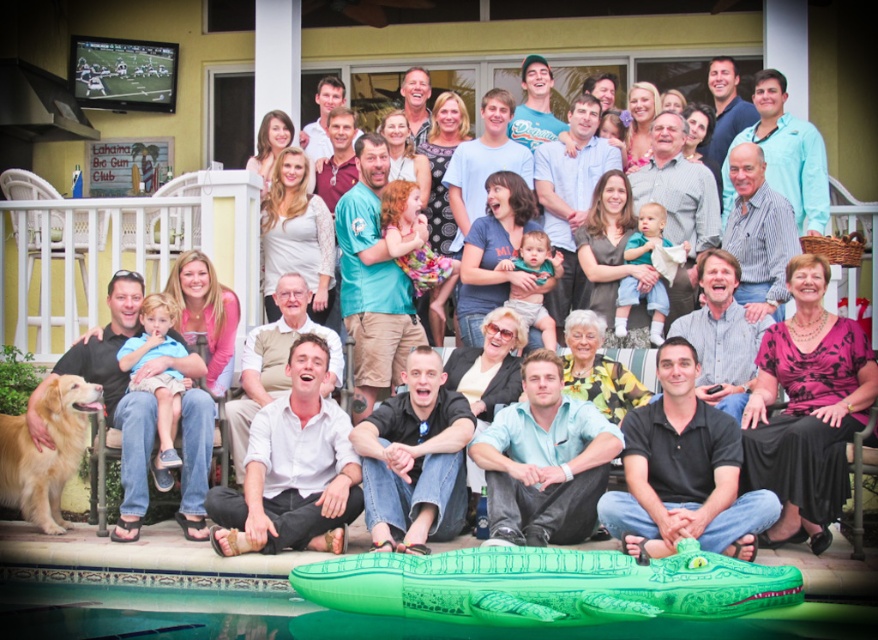
Question: Which object is farther from the camera taking this photo?

Choices:
 (A) golden matte dog at lower left
 (B) green inflatable boat at lower center

Answer: (A)

Question: Considering the relative positions of green inflatable boat at lower center and golden matte dog at lower left in the image provided, where is green inflatable boat at lower center located with respect to golden matte dog at lower left?

Choices:
 (A) left
 (B) right

Answer: (B)

Question: Does green inflatable boat at lower center have a larger size compared to golden matte dog at lower left?

Choices:
 (A) no
 (B) yes

Answer: (B)

Question: Which of the following is the closest to the observer?

Choices:
 (A) green inflatable boat at lower center
 (B) golden matte dog at lower left

Answer: (A)

Question: Which object appears closest to the camera in this image?

Choices:
 (A) golden matte dog at lower left
 (B) green inflatable boat at lower center

Answer: (B)

Question: Can you confirm if green inflatable boat at lower center is positioned to the right of golden matte dog at lower left?

Choices:
 (A) no
 (B) yes

Answer: (B)